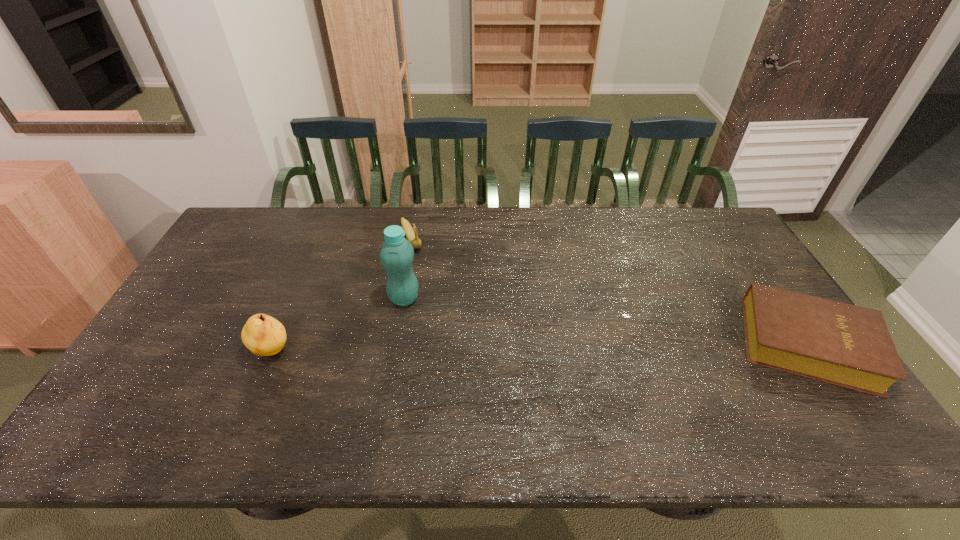
The height and width of the screenshot is (540, 960). I want to click on free space on the desktop that is between the second tallest object and the Bible and is positioned at the front cap of the water bottle, so click(491, 348).

In order to click on free space on the desktop that is between the leftmost object and the Bible and is positioned at the stem of the third tallest object in this screenshot , I will do `click(469, 349)`.